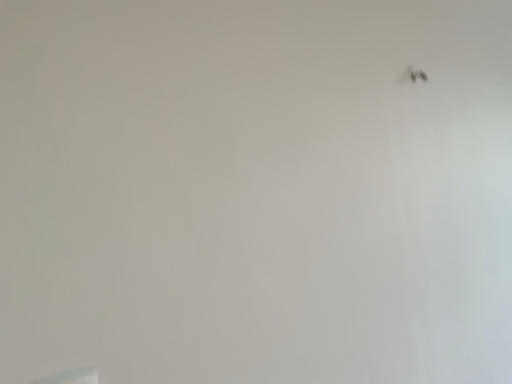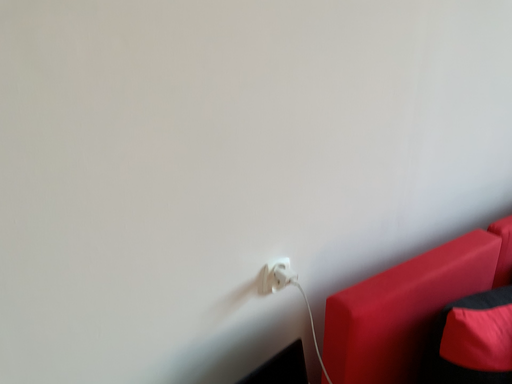
Question: How did the camera likely rotate when shooting the video?

Choices:
 (A) rotated upward
 (B) rotated downward

Answer: (B)